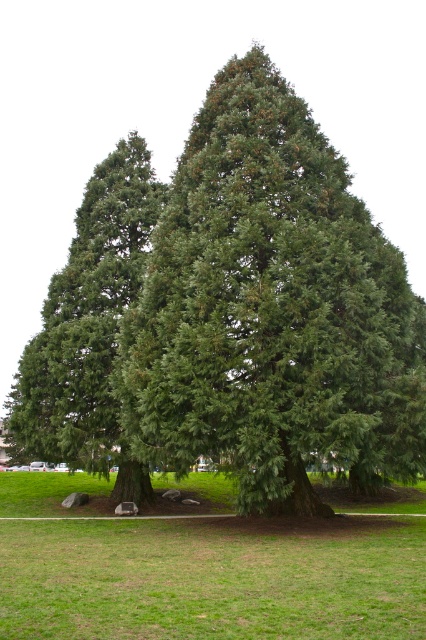
Who is positioned more to the right, green needle-like leaves at center or green needle-like at left?

From the viewer's perspective, green needle-like leaves at center appears more on the right side.

Who is more distant from viewer, (365, 440) or (86, 346)?

The point (86, 346) is more distant.

Who is more distant from viewer, (411, 305) or (86, 272)?

The point (86, 272) is more distant.

Identify the location of green needle-like leaves at center. (271, 310).

Does green needle-like leaves at center have a lesser height compared to green grass at center?

No, green needle-like leaves at center is not shorter than green grass at center.

Is point (224, 186) positioned in front of point (167, 540)?

No, it is behind (167, 540).

Where is `green needle-like leaves at center`? This screenshot has width=426, height=640. green needle-like leaves at center is located at coordinates (271, 310).

Who is shorter, green grass at center or green needle-like at left?

green grass at center

Is point (173, 529) closer to viewer compared to point (63, 285)?

Yes, point (173, 529) is closer to viewer.

Locate an element on the screen. This screenshot has width=426, height=640. green grass at center is located at coordinates (213, 579).

Where is `green grass at center`? The height and width of the screenshot is (640, 426). green grass at center is located at coordinates (213, 579).